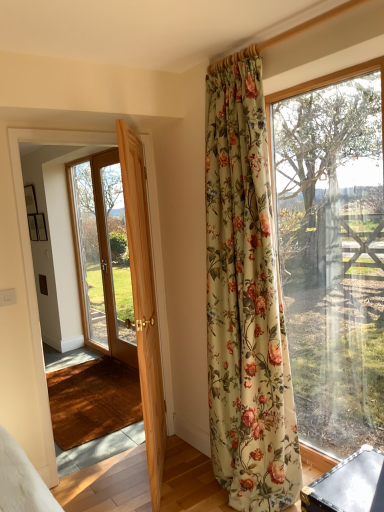
Question: Could you tell me if floral fabric curtain at upper right is facing light wood door at left?

Choices:
 (A) yes
 (B) no

Answer: (B)

Question: Considering the relative sizes of floral fabric curtain at upper right and light wood door at left in the image provided, is floral fabric curtain at upper right taller than light wood door at left?

Choices:
 (A) yes
 (B) no

Answer: (A)

Question: Is light wood door at left at the back of floral fabric curtain at upper right?

Choices:
 (A) no
 (B) yes

Answer: (A)

Question: Is floral fabric curtain at upper right shorter than light wood door at left?

Choices:
 (A) no
 (B) yes

Answer: (A)

Question: From a real-world perspective, is floral fabric curtain at upper right positioned under light wood door at left based on gravity?

Choices:
 (A) yes
 (B) no

Answer: (B)

Question: From a real-world perspective, relative to light wood door at left, is clear glass door at left vertically above or below?

Choices:
 (A) above
 (B) below

Answer: (A)

Question: From their relative heights in the image, would you say clear glass door at left is taller or shorter than light wood door at left?

Choices:
 (A) short
 (B) tall

Answer: (B)

Question: Visually, is clear glass door at left positioned to the left or to the right of light wood door at left?

Choices:
 (A) right
 (B) left

Answer: (B)

Question: From the image's perspective, is clear glass door at left located above or below light wood door at left?

Choices:
 (A) above
 (B) below

Answer: (A)

Question: Is point (301, 246) positioned closer to the camera than point (112, 229)?

Choices:
 (A) closer
 (B) farther

Answer: (A)

Question: In terms of width, does transparent glass window at right look wider or thinner when compared to clear glass door at left?

Choices:
 (A) thin
 (B) wide

Answer: (A)

Question: From a real-world perspective, is transparent glass window at right positioned above or below clear glass door at left?

Choices:
 (A) below
 (B) above

Answer: (A)

Question: Considering their positions, is transparent glass window at right located in front of or behind clear glass door at left?

Choices:
 (A) behind
 (B) front

Answer: (B)

Question: From a real-world perspective, is floral fabric curtain at upper right above or below wooden barn door at left?

Choices:
 (A) below
 (B) above

Answer: (B)

Question: From the image's perspective, is floral fabric curtain at upper right above or below wooden barn door at left?

Choices:
 (A) below
 (B) above

Answer: (B)